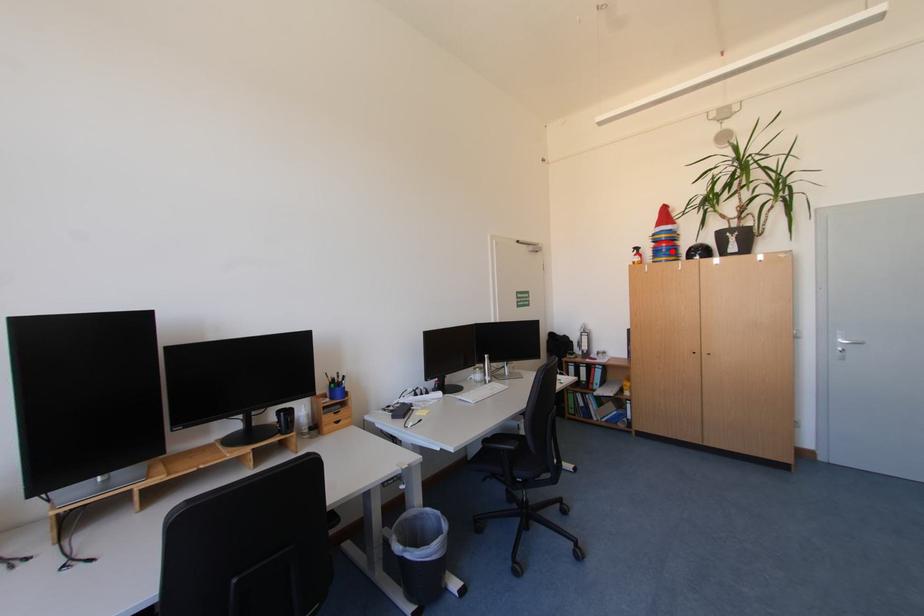
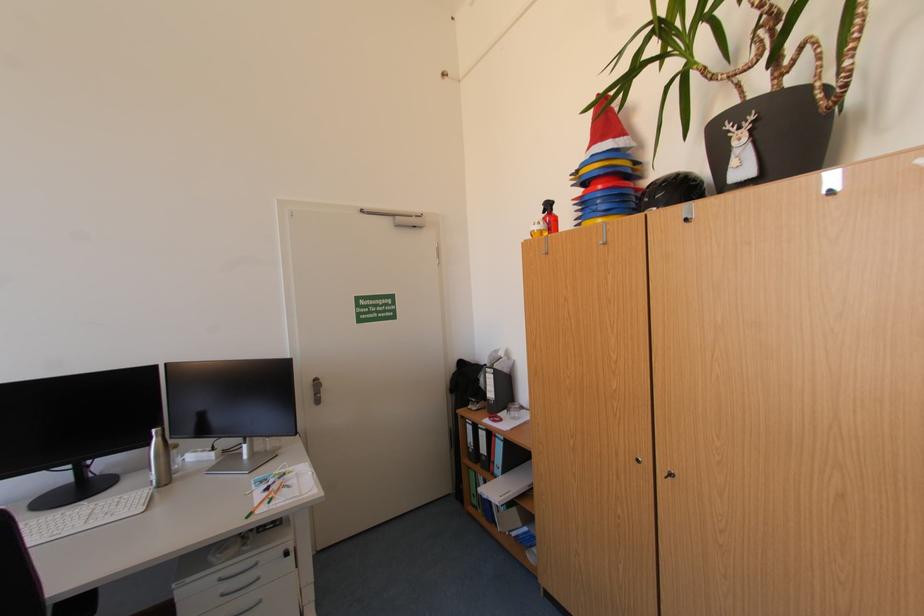
Question: I am providing you with two images of the same scene from different viewpoints. A red point is marked on the first image. Can you still see the location of the red point in image 2?

Choices:
 (A) Yes
 (B) No

Answer: (A)